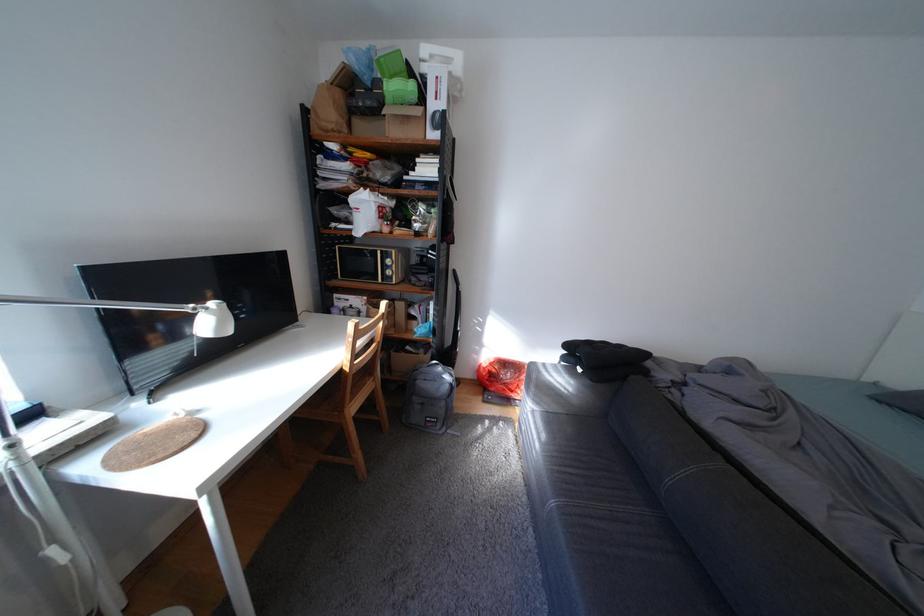
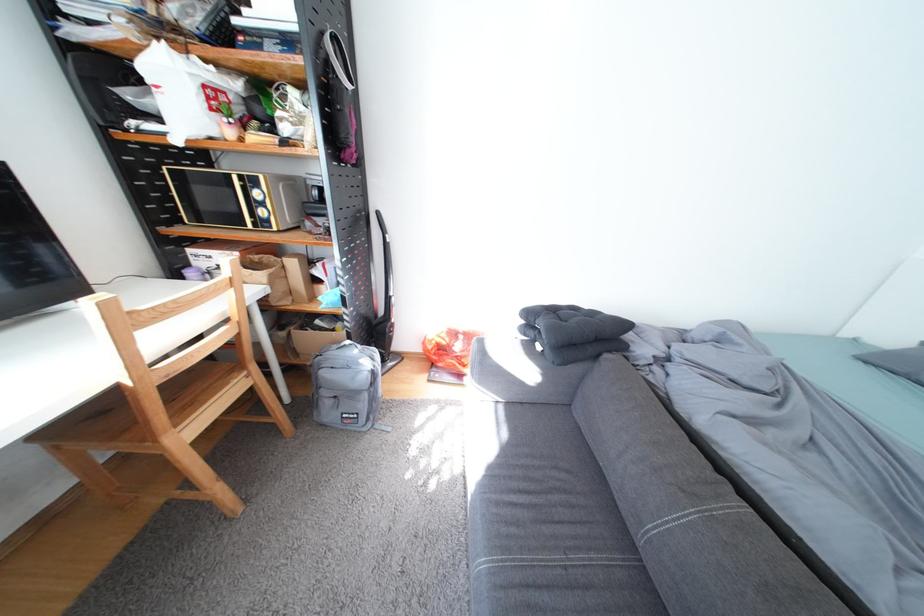
Locate, in the second image, the point that corresponds to the point at 525,392 in the first image.

(477, 367)